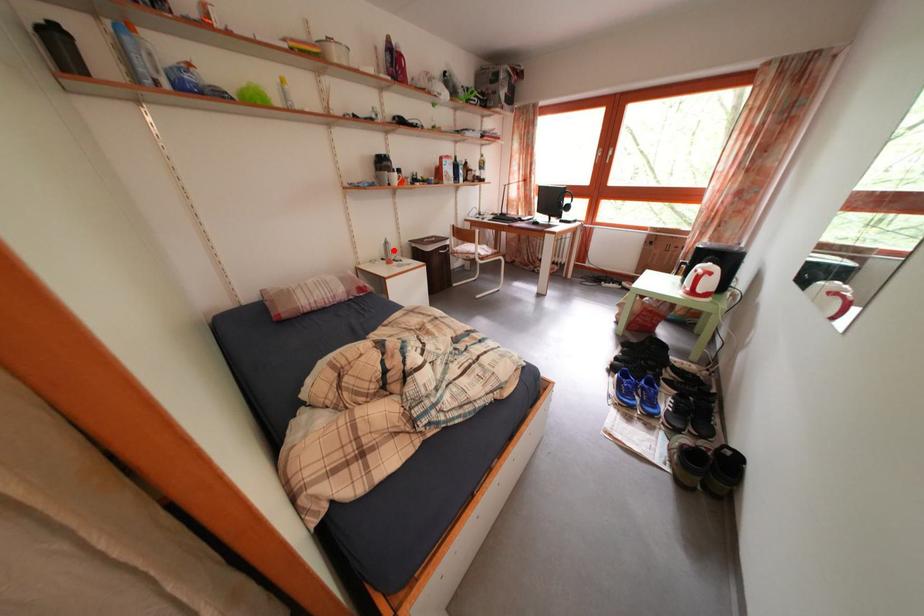
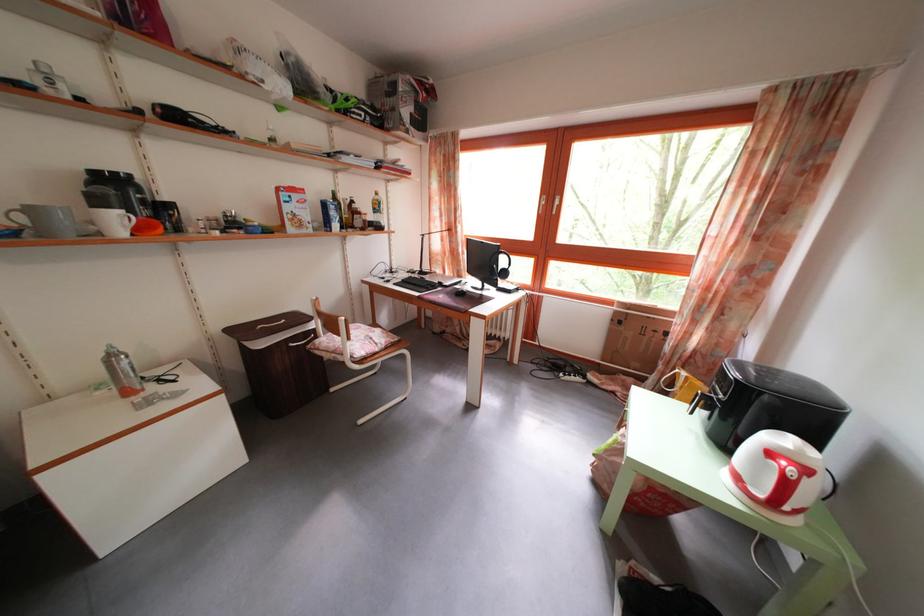
Find the pixel in the second image that matches the highlighted location in the first image.

(118, 363)